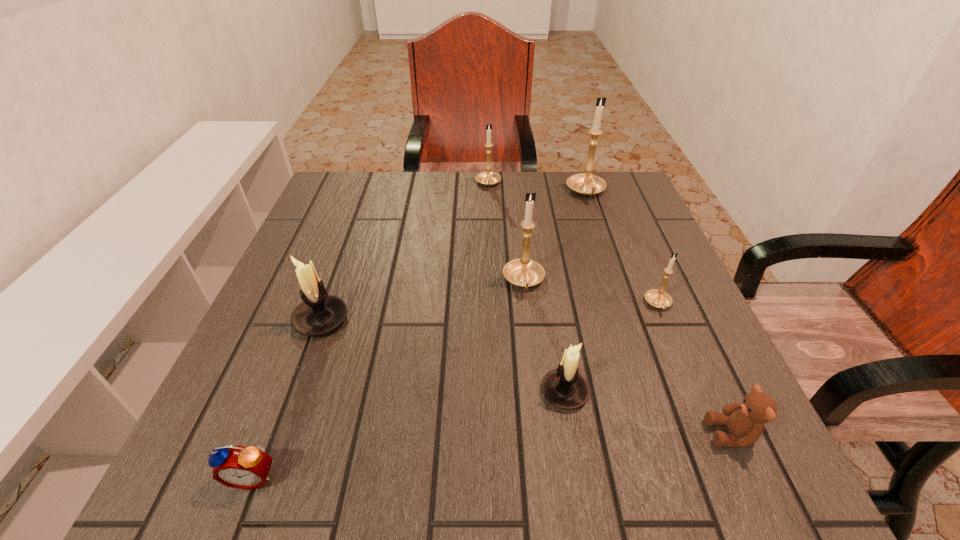
Locate an element on the screen. The image size is (960, 540). free space between the biggest gold candle holder and the smallest gold candle holder is located at coordinates (622, 248).

I want to click on vacant area between the right white candle holder and the red alarm clock, so click(x=409, y=434).

The image size is (960, 540). I want to click on free area in between the seventh shortest object and the smallest gold candle holder, so click(591, 293).

The width and height of the screenshot is (960, 540). I want to click on free space between the alarm clock and the tallest object, so click(x=420, y=334).

Identify the location of free area in between the leftmost candle holder and the smallest gold candle holder. Image resolution: width=960 pixels, height=540 pixels. (490, 312).

Identify which object is the closest to the third biggest gold candle holder. Please provide its 2D coordinates. Your answer should be formatted as a tuple, i.e. [(x, y)], where the tuple contains the x and y coordinates of a point satisfying the conditions above.

[(587, 184)]

The height and width of the screenshot is (540, 960). What are the coordinates of `object that is the nearest to the second smallest gold candle holder` in the screenshot? It's located at (587, 184).

Select which candle holder appears as the second closest to the fifth shortest candle holder. Please provide its 2D coordinates. Your answer should be formatted as a tuple, i.e. [(x, y)], where the tuple contains the x and y coordinates of a point satisfying the conditions above.

[(657, 298)]

At what (x,y) coordinates should I click in order to perform the action: click on candle holder object that ranks as the second closest to the second tallest candle holder. Please return your answer as a coordinate pair (x, y). The width and height of the screenshot is (960, 540). Looking at the image, I should click on (657, 298).

Where is `gold candle holder identified as the fourth closest to the leftmost candle holder`? Image resolution: width=960 pixels, height=540 pixels. gold candle holder identified as the fourth closest to the leftmost candle holder is located at coordinates (587, 184).